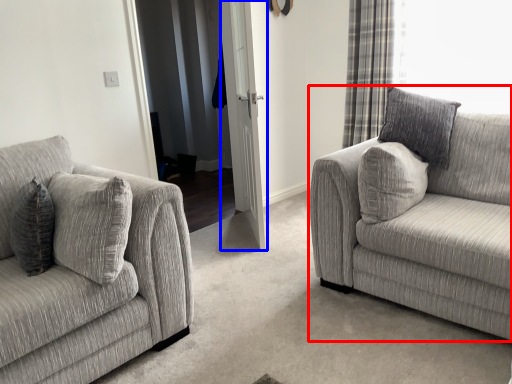
Question: Which object is further to the camera taking this photo, studio couch (highlighted by a red box) or screen door (highlighted by a blue box)?

Choices:
 (A) studio couch
 (B) screen door

Answer: (B)